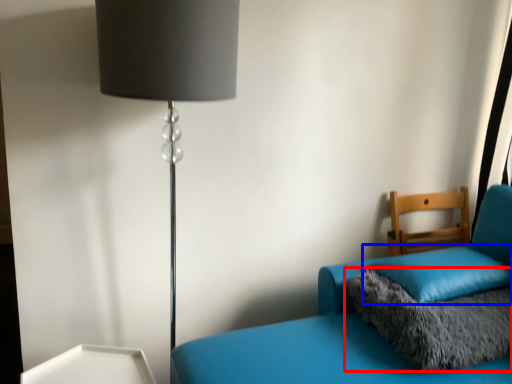
Question: Which object appears closest to the camera in this image, pillow (highlighted by a red box) or pillow (highlighted by a blue box)?

Choices:
 (A) pillow
 (B) pillow

Answer: (A)